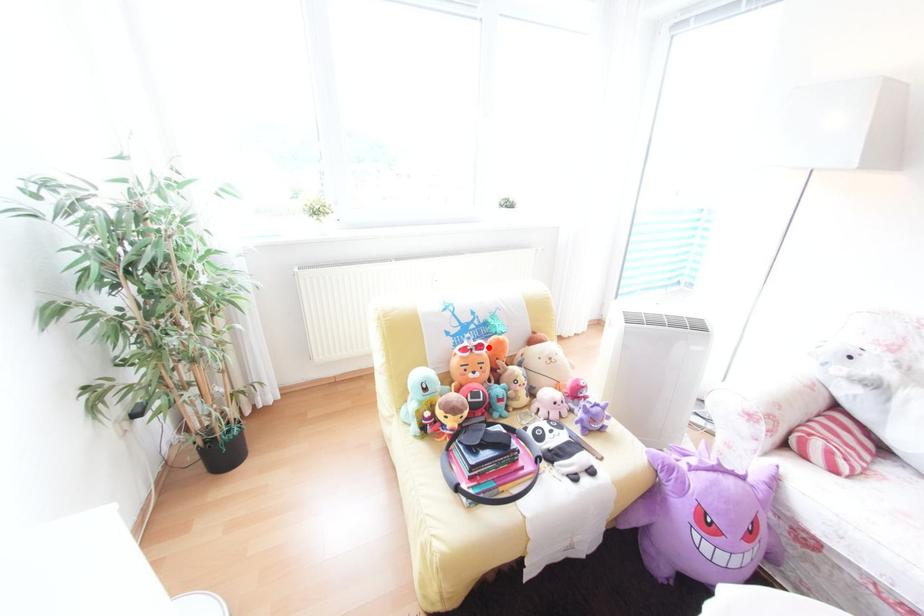
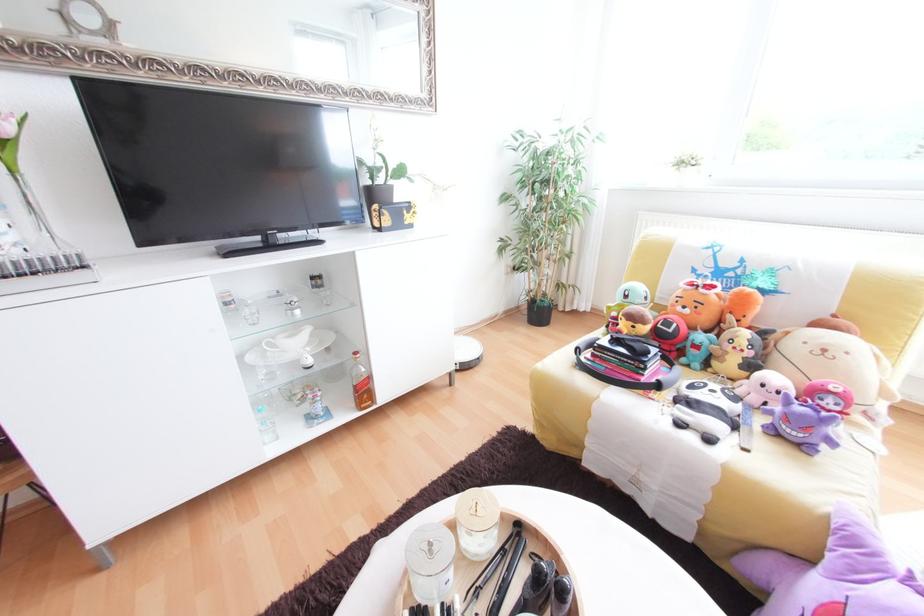
In the second image, find the point that corresponds to the highlighted location in the first image.

(719, 288)